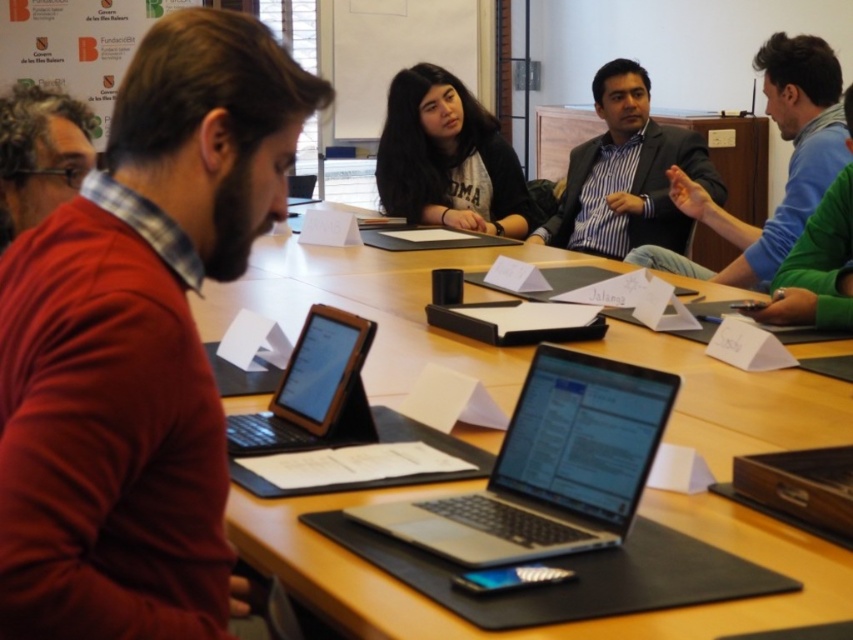
You are standing at the entrance of the room and see the wooden table at center and the matte black shirt at center. Which object is located to the right when facing the scene?

The wooden table at center is to the right of the matte black shirt at center, so the wooden table at center is located to the right when facing the scene.

You are a participant in the meeting and want to write a note on the whiteboard at upper center. Can you reach it from where the matte red sweater at left is located?

The matte red sweater at left is positioned under the whiteboard at upper center, so yes, you can reach the whiteboard at upper center from that location.